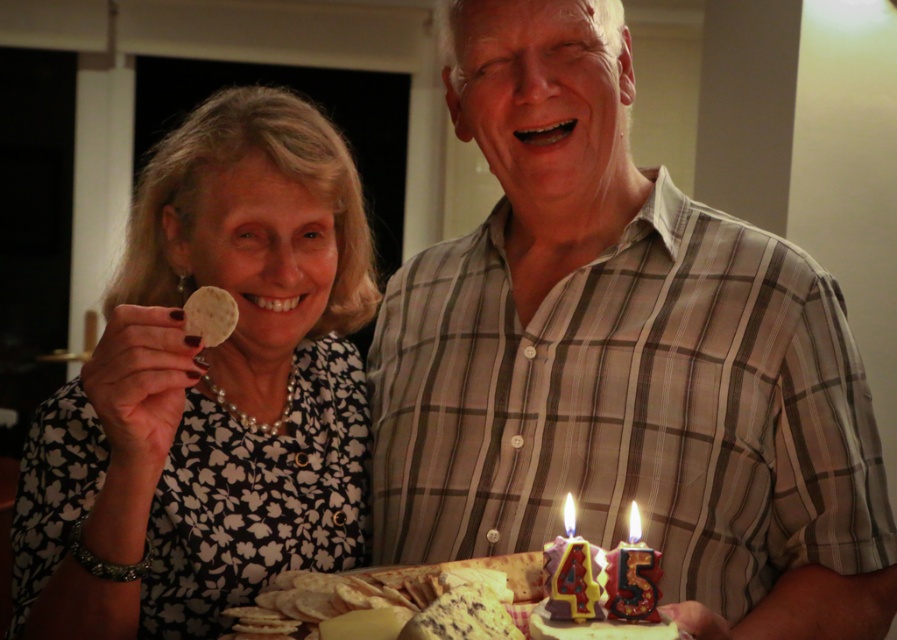
Question: Which of the following is the farthest from the observer?

Choices:
 (A) plaid shirt at center
 (B) matte plastic candle at lower center

Answer: (A)

Question: Does white matte chip at upper left lie in front of matte plastic candle at lower center?

Choices:
 (A) yes
 (B) no

Answer: (B)

Question: Does plaid shirt at center appear under white matte chip at upper left?

Choices:
 (A) yes
 (B) no

Answer: (A)

Question: Estimate the real-world distances between objects in this image. Which object is closer to the matte plastic candle at lower center?

Choices:
 (A) yellow waxy candle at center
 (B) plaid shirt at center
 (C) white matte chip at upper left
 (D) matte plastic candle at center

Answer: (A)

Question: Does yellow waxy candle at center have a greater width compared to matte plastic candle at center?

Choices:
 (A) yes
 (B) no

Answer: (A)

Question: Among these points, which one is nearest to the camera?

Choices:
 (A) (205, 493)
 (B) (573, 552)

Answer: (B)